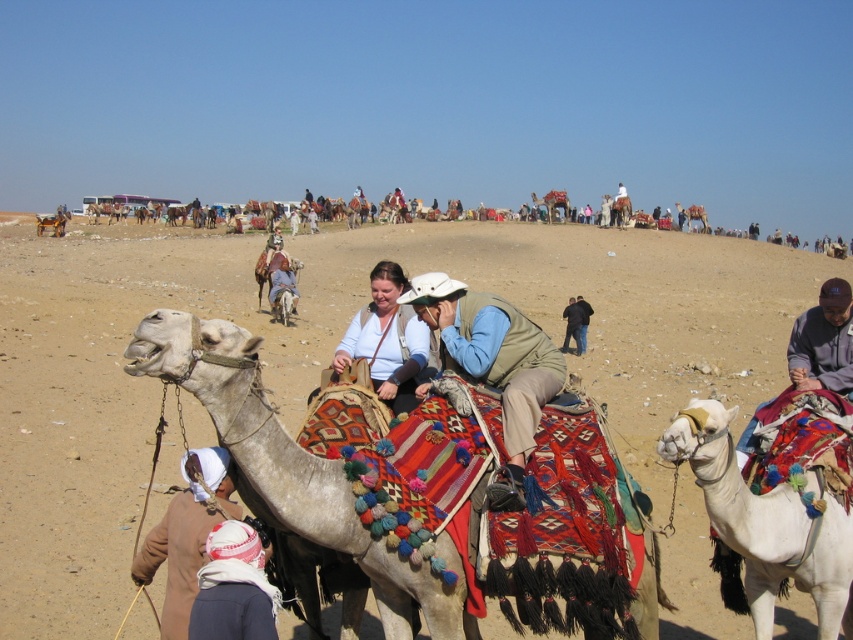
Is the position of light brown leather jacket at center more distant than that of light blue denim shirt at center?

No, light brown leather jacket at center is in front of light blue denim shirt at center.

Can you confirm if light brown leather jacket at center is wider than light blue denim shirt at center?

No.

Does point (405, 355) lie in front of point (270, 301)?

Yes, point (405, 355) is in front of point (270, 301).

Identify the location of light brown leather jacket at center. (387, 339).

Measure the distance between point (200,554) and camera.

Point (200,554) and camera are 4.28 meters apart from each other.

Does point (189, 588) lie in front of point (567, 310)?

Yes, point (189, 588) is in front of point (567, 310).

Where is `brown cotton headscarf at lower left`? brown cotton headscarf at lower left is located at coordinates (186, 536).

Between white cotton headscarf at lower left and dark gray fabric at right, which one has less height?

Standing shorter between the two is white cotton headscarf at lower left.

Is white cotton headscarf at lower left shorter than dark gray fabric at right?

Indeed, white cotton headscarf at lower left has a lesser height compared to dark gray fabric at right.

This screenshot has height=640, width=853. Find the location of `white cotton headscarf at lower left`. white cotton headscarf at lower left is located at coordinates (233, 588).

Identify the location of white cotton headscarf at lower left. (233, 588).